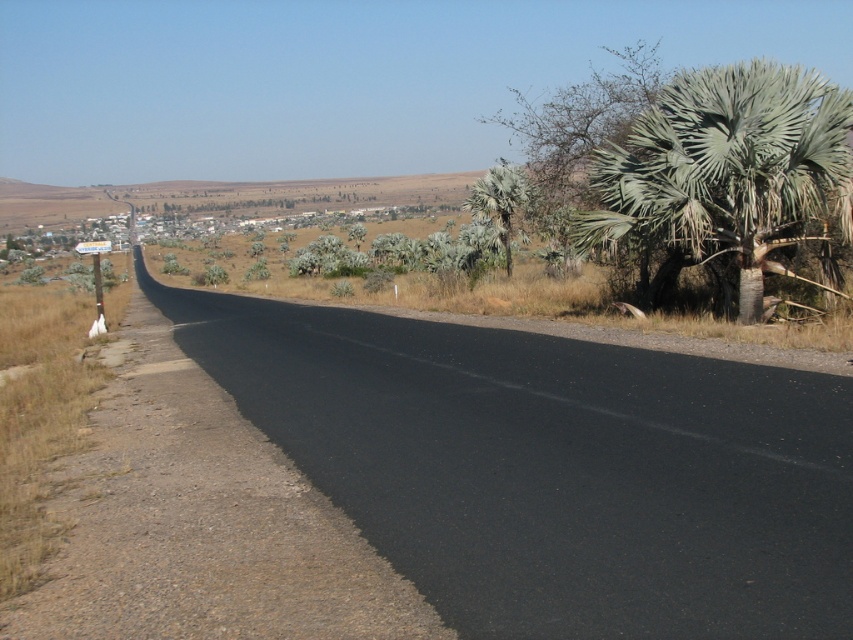
You are standing at the center of the road and looking towards the distant horizon. Which direction should you turn to find the green leafy palm tree at right?

The green leafy palm tree at right is located at the right side of the road, so you should turn to your right to find it.

You are standing at the starting point of the road and see the point marked at coordinate (726, 168). What object is located at that point?

The point at coordinate (726, 168) indicates a green leafy palm tree at right.